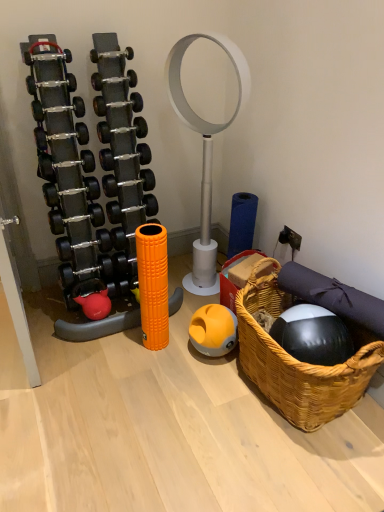
Question: From the image's perspective, relative to woven brown basket at lower right, is rubberized red kettlebell at lower left above or below?

Choices:
 (A) below
 (B) above

Answer: (B)

Question: Is rubberized red kettlebell at lower left taller or shorter than woven brown basket at lower right?

Choices:
 (A) tall
 (B) short

Answer: (B)

Question: Estimate the real-world distances between objects in this image. Which object is farther from the matte black dumbbell at center?

Choices:
 (A) orange rubber ball at center
 (B) rubberized red kettlebell at lower left
 (C) woven brown basket at lower right

Answer: (C)

Question: Which object is the farthest from the woven brown basket at lower right?

Choices:
 (A) matte black dumbbell at center
 (B) rubberized red kettlebell at lower left
 (C) orange rubber ball at center

Answer: (A)